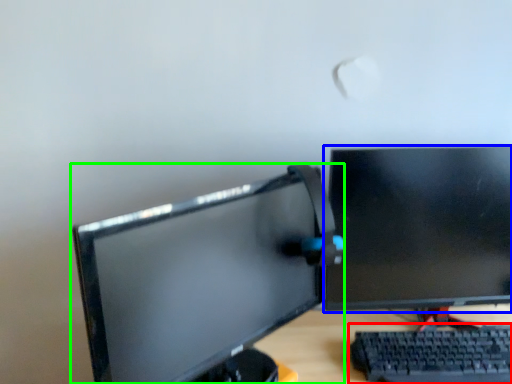
Question: Which object is positioned closest to computer keyboard (highlighted by a red box)? Select from computer monitor (highlighted by a blue box) and computer monitor (highlighted by a green box).

Choices:
 (A) computer monitor
 (B) computer monitor

Answer: (A)